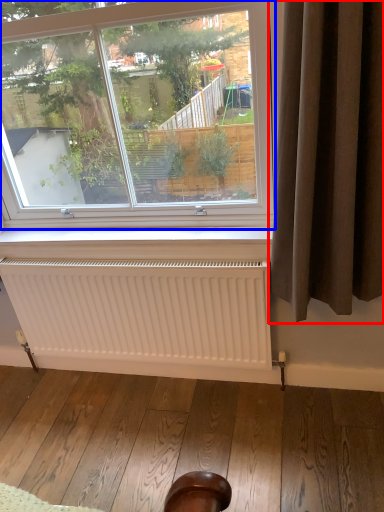
Question: Among these objects, which one is nearest to the camera, curtain (highlighted by a red box) or window (highlighted by a blue box)?

Choices:
 (A) curtain
 (B) window

Answer: (A)